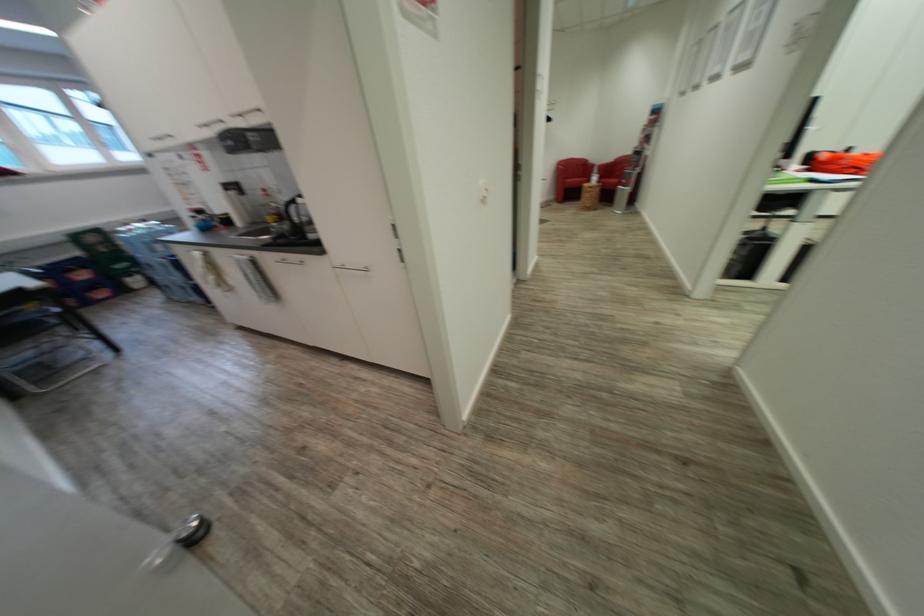
Where is `black kettle handle`? The width and height of the screenshot is (924, 616). black kettle handle is located at coordinates click(287, 211).